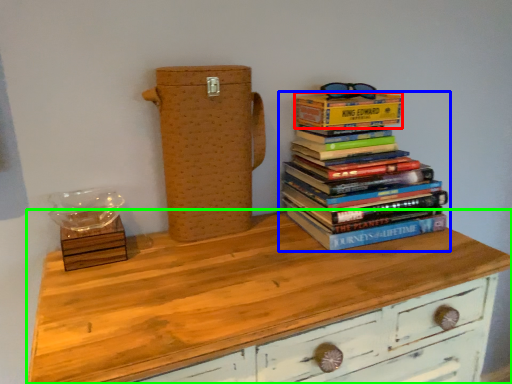
Question: Estimate the real-world distances between objects in this image. Which object is closer to paperback book (highlighted by a red box), book (highlighted by a blue box) or chest of drawers (highlighted by a green box)?

Choices:
 (A) book
 (B) chest of drawers

Answer: (A)